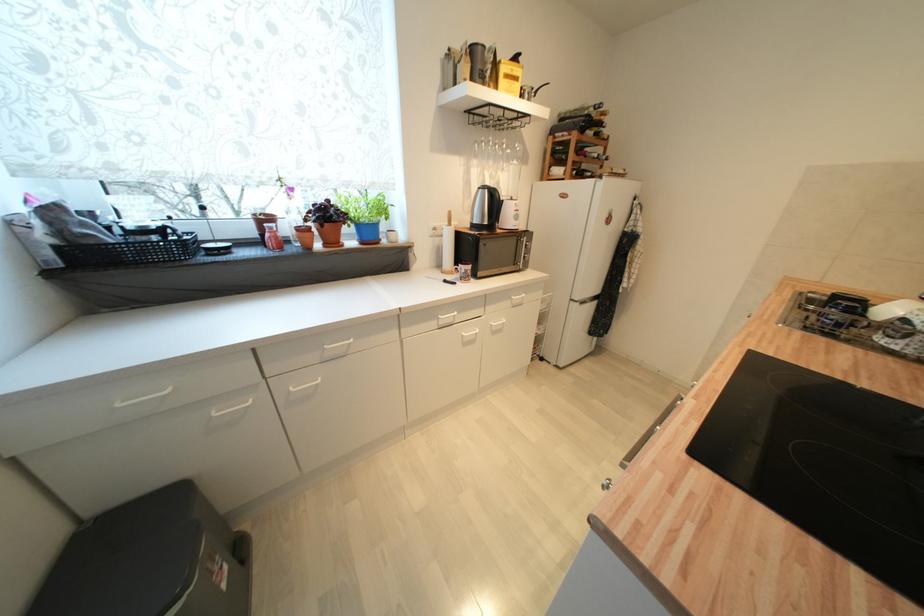
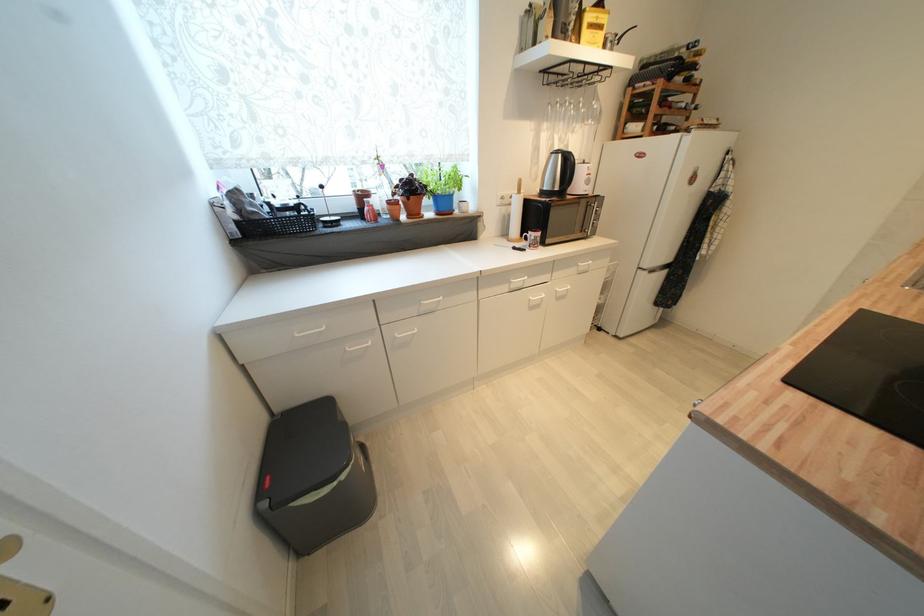
Locate, in the second image, the point that corresponds to [469,342] in the first image.

(536, 306)